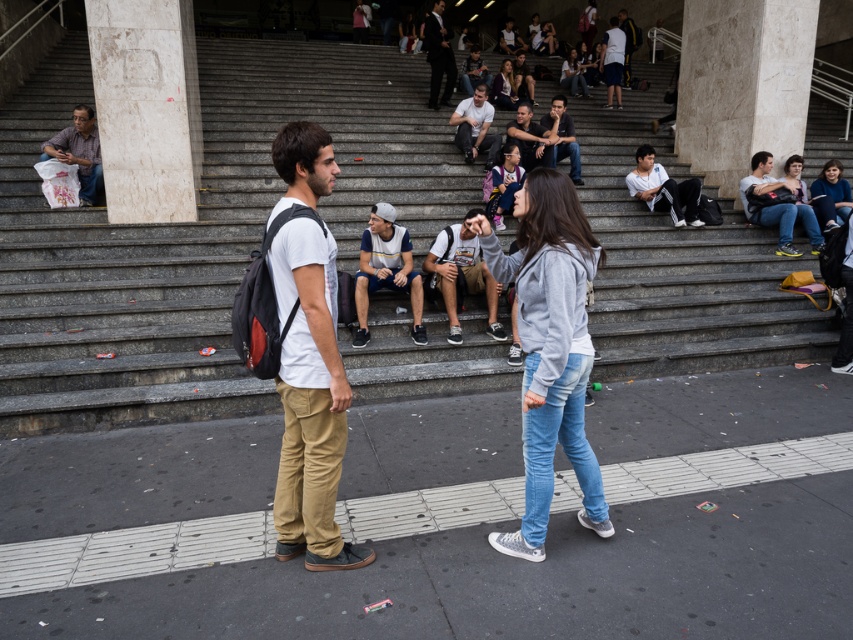
This screenshot has height=640, width=853. What are the coordinates of `dark gray backpack at right` in the screenshot? It's located at (776, 205).

Can you confirm if dark gray backpack at right is taller than dark gray shirt at center?

In fact, dark gray backpack at right may be shorter than dark gray shirt at center.

The height and width of the screenshot is (640, 853). Identify the location of dark gray backpack at right. (776, 205).

Is white cotton t-shirt at center positioned at the back of dark blue jeans at center?

No, it is in front of dark blue jeans at center.

Where is `white cotton t-shirt at center`? white cotton t-shirt at center is located at coordinates (309, 401).

Does white cotton t-shirt at center have a smaller size compared to dark suit at center?

Correct, white cotton t-shirt at center occupies less space than dark suit at center.

Who is more forward, (349, 388) or (440, 100)?

Point (349, 388) is in front.

The width and height of the screenshot is (853, 640). In order to click on white cotton t-shirt at center in this screenshot , I will do `click(309, 401)`.